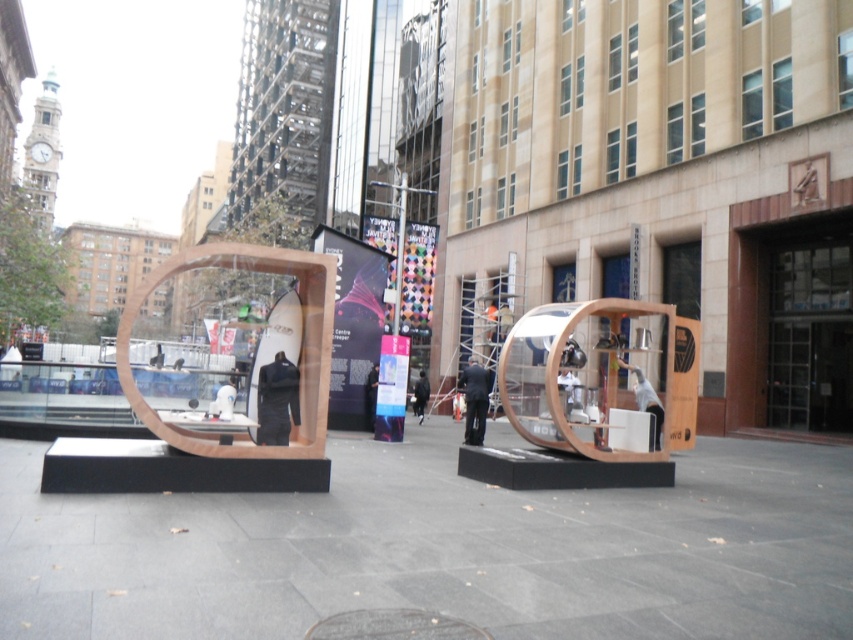
Is dark fabric jacket at center taller than white fabric bag at center?

Yes, dark fabric jacket at center is taller than white fabric bag at center.

Can you confirm if dark fabric jacket at center is thinner than white fabric bag at center?

In fact, dark fabric jacket at center might be wider than white fabric bag at center.

Who is more distant from viewer, [279,353] or [231,412]?

Point [279,353]

Locate an element on the screen. dark fabric jacket at center is located at coordinates (277, 401).

Does dark fabric jacket at center have a greater height compared to black fabric at center?

No.

Can you confirm if dark fabric jacket at center is bigger than black fabric at center?

No, dark fabric jacket at center is not bigger than black fabric at center.

Is point (259, 412) closer to viewer compared to point (369, 384)?

Yes, point (259, 412) is in front of point (369, 384).

I want to click on dark fabric jacket at center, so click(277, 401).

Is point (258, 378) farther from viewer compared to point (469, 388)?

That is False.

Can you confirm if dark fabric jacket at center is positioned above dark suit at center?

Correct, dark fabric jacket at center is located above dark suit at center.

Is point (277, 432) less distant than point (476, 378)?

Yes.

The height and width of the screenshot is (640, 853). In order to click on dark fabric jacket at center in this screenshot , I will do `click(277, 401)`.